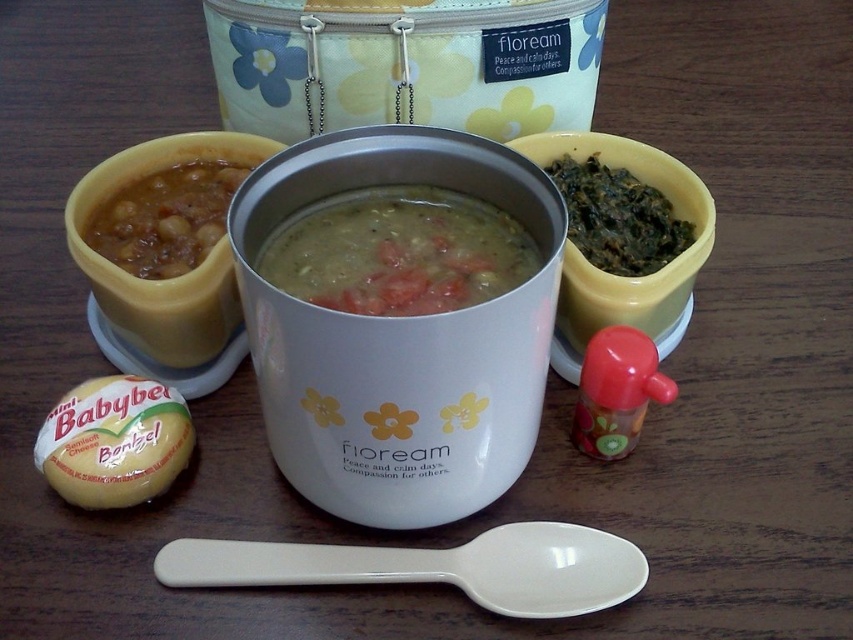
You need to stir the soup in the floream jar but the spoon is currently at the lower center. Where exactly is the white plastic spoon at lower center positioned in relation to the jar?

The white plastic spoon at lower center is located at coordinates point [434,566], which is to the right and slightly above the floream jar.